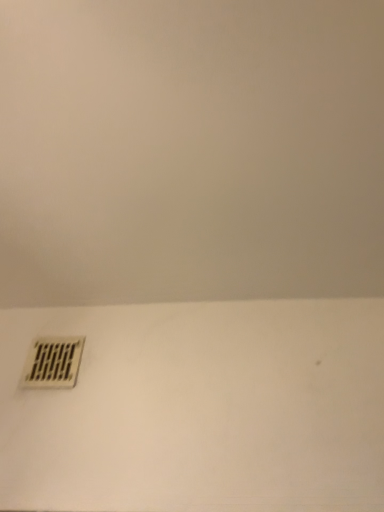
Image resolution: width=384 pixels, height=512 pixels. What do you see at coordinates (53, 362) in the screenshot? I see `white plastic power plugs and sockets at lower left` at bounding box center [53, 362].

Identify the location of white plastic power plugs and sockets at lower left. The image size is (384, 512). (53, 362).

Find the location of a particular element. The image size is (384, 512). white plastic power plugs and sockets at lower left is located at coordinates (53, 362).